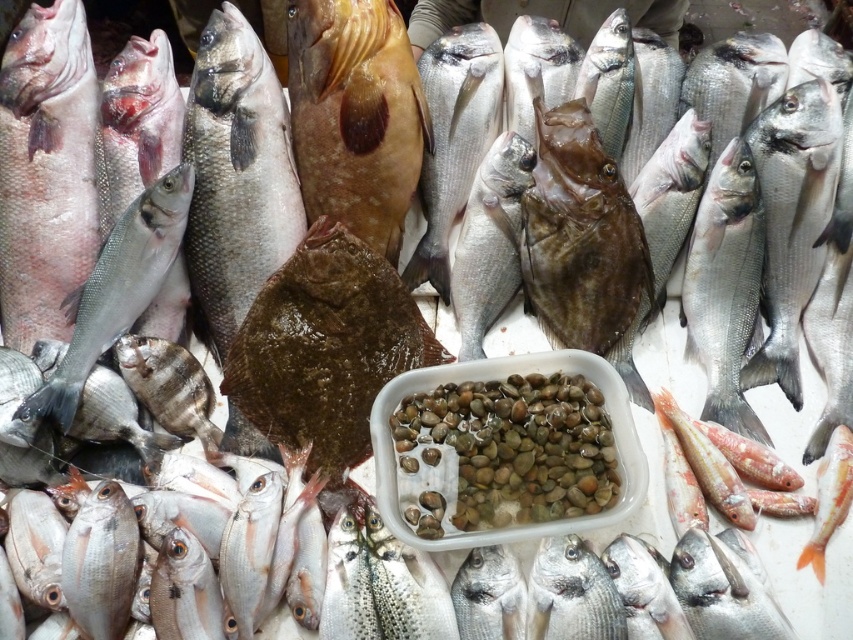
Question: Is silver metallic fish at right below shiny brown fish at center?

Choices:
 (A) yes
 (B) no

Answer: (A)

Question: Estimate the real-world distances between objects in this image. Which object is farther from the brown textured fish at center?

Choices:
 (A) silver metallic fish at left
 (B) silver metallic fish at right
 (C) shiny silver fish at center

Answer: (B)

Question: Does silver metallic fish at right have a smaller size compared to silver metallic fish at left?

Choices:
 (A) yes
 (B) no

Answer: (A)

Question: Which of the following is the closest to the observer?

Choices:
 (A) matte pinkish fish at left
 (B) shiny brown fish at center
 (C) brown textured fish at center

Answer: (A)

Question: Considering the real-world distances, which object is closest to the silver metallic fish at left?

Choices:
 (A) shiny silver fish at center
 (B) matte pinkish fish at left
 (C) brown textured fish at center

Answer: (B)

Question: Can you confirm if brown textured fish at center is positioned above shiny brown fish at center?

Choices:
 (A) yes
 (B) no

Answer: (A)